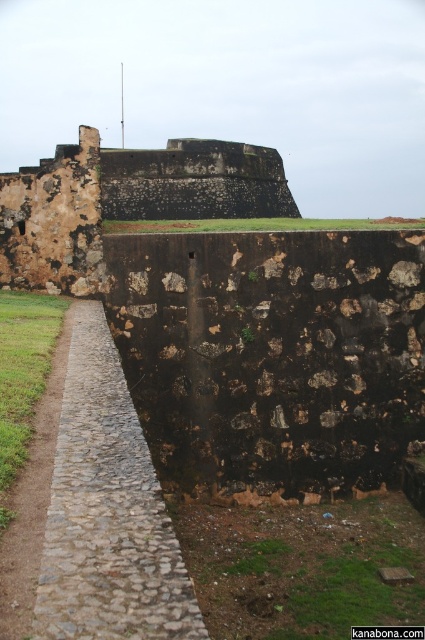
Question: Which object appears farthest from the camera in this image?

Choices:
 (A) rusty stone wall at center
 (B) gray cobblestone path at center

Answer: (A)

Question: Is gray cobblestone path at center thinner than rusty stone wall at center?

Choices:
 (A) no
 (B) yes

Answer: (B)

Question: Among these objects, which one is nearest to the camera?

Choices:
 (A) rusty stone wall at center
 (B) gray cobblestone path at center

Answer: (B)

Question: Is gray cobblestone path at center smaller than rusty stone wall at center?

Choices:
 (A) yes
 (B) no

Answer: (A)

Question: From the image, what is the correct spatial relationship of gray cobblestone path at center in relation to rusty stone wall at center?

Choices:
 (A) below
 (B) above

Answer: (A)